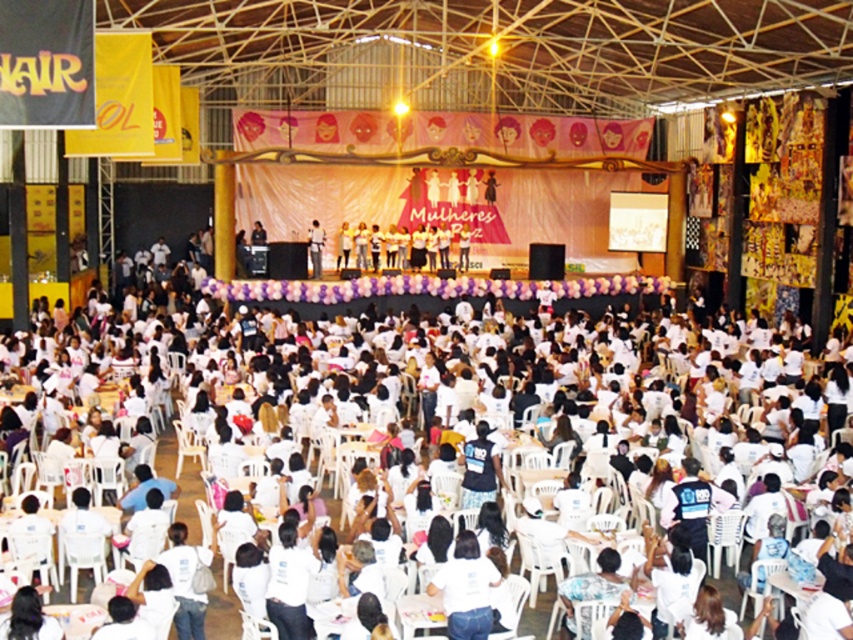
You are an event organizer who needs to identify the attendee closest to the stage. You see the white matte shirt at lower center and the matte black shirt at center. Which attendee is closer to the stage?

The white matte shirt at lower center is in front of the matte black shirt at center, so the attendee in the white matte shirt at lower center is closer to the stage.

You are organizing a photo shoot for the event and need to position two models wearing the white matte shirt at lower center and the matte black shirt at center. Based on the scene description, which shirt is positioned to the right of the other?

The white matte shirt at lower center is positioned to the right of the matte black shirt at center.

You are organizing a photo shoot in the event space and need to position two shirts for a promotional image. The white matte shirt at lower center and the matte black shirt at center must be arranged so that one is taller than the other. Which shirt should be placed higher to maintain their original height relationship?

The white matte shirt at lower center should be placed higher because it is taller than the matte black shirt at center according to their original positions.